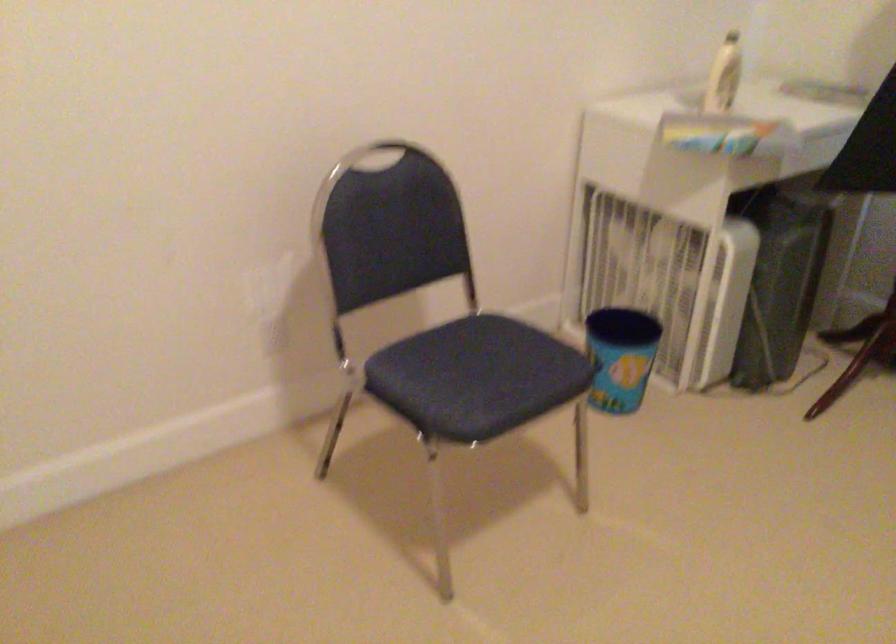
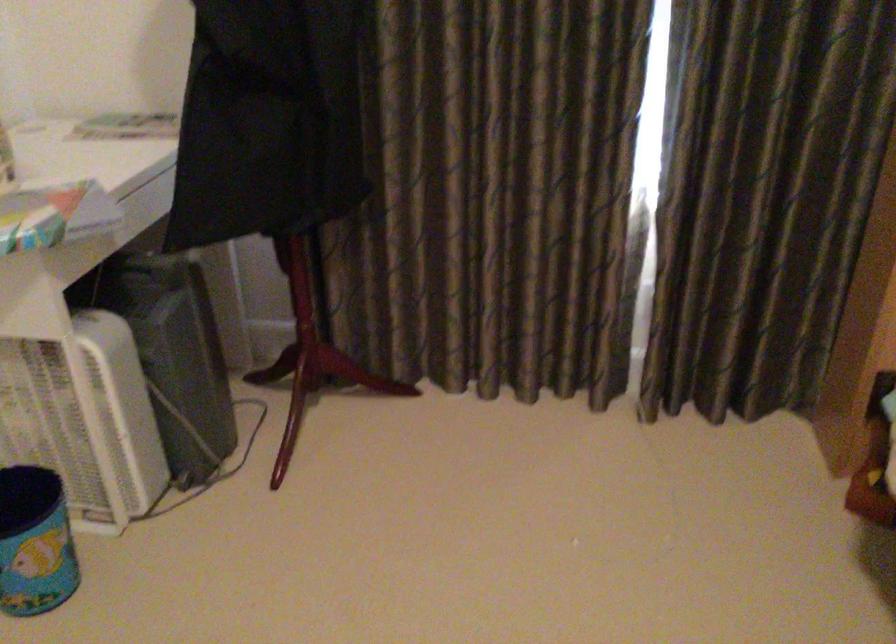
Question: The images are taken continuously from a first-person perspective. In which direction is your viewpoint rotating?

Choices:
 (A) Left
 (B) Right
 (C) Up
 (D) Down

Answer: (B)